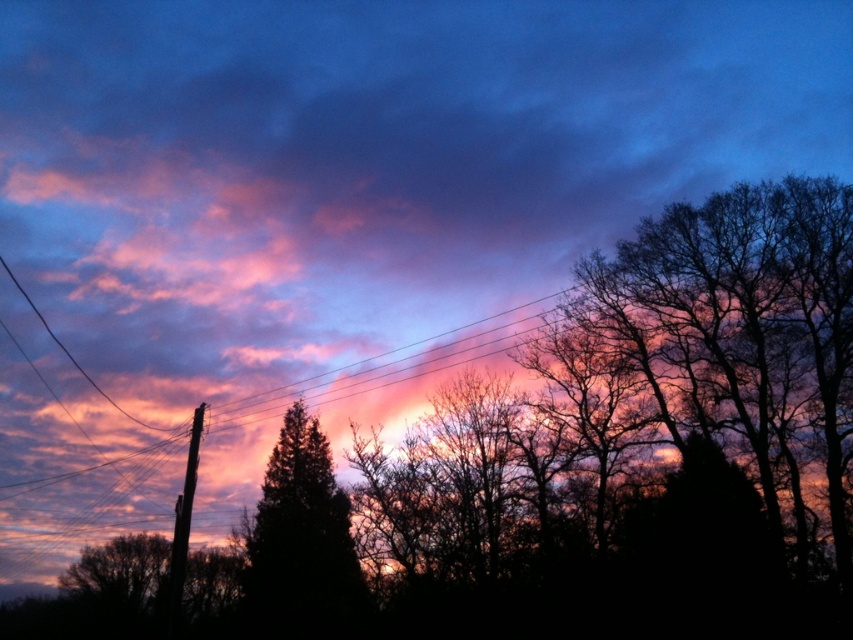
Question: Can you confirm if green matte tree at center is thinner than brown wooden telegraph pole at left?

Choices:
 (A) yes
 (B) no

Answer: (A)

Question: Where is green matte tree at center located in relation to brown wooden telegraph pole at left in the image?

Choices:
 (A) right
 (B) left

Answer: (A)

Question: Does green matte tree at center lie behind brown wooden telegraph pole at left?

Choices:
 (A) yes
 (B) no

Answer: (A)

Question: Which object appears farthest from the camera in this image?

Choices:
 (A) brown wooden telegraph pole at left
 (B) green matte tree at center

Answer: (B)

Question: Which object is closer to the camera taking this photo?

Choices:
 (A) green matte tree at center
 (B) brown wooden telegraph pole at left

Answer: (B)